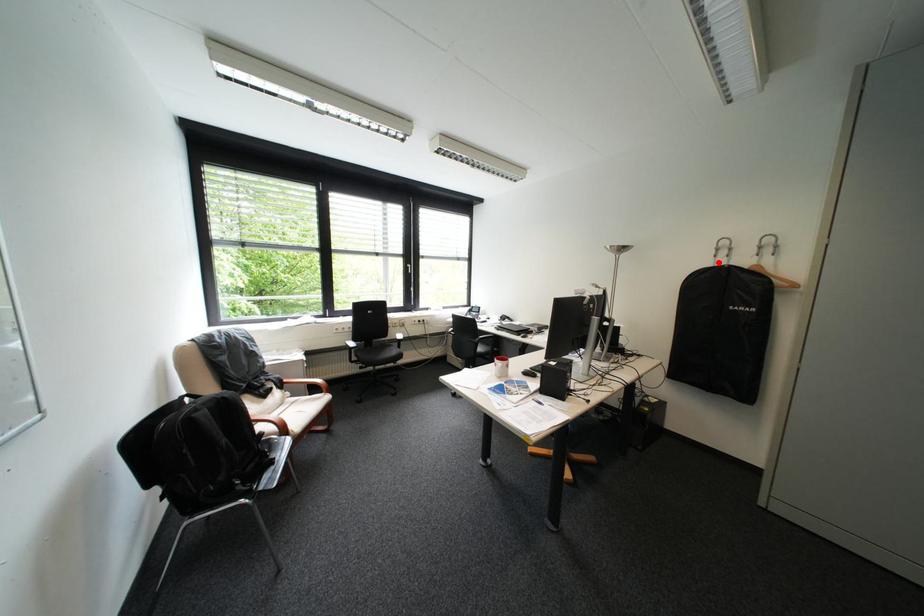
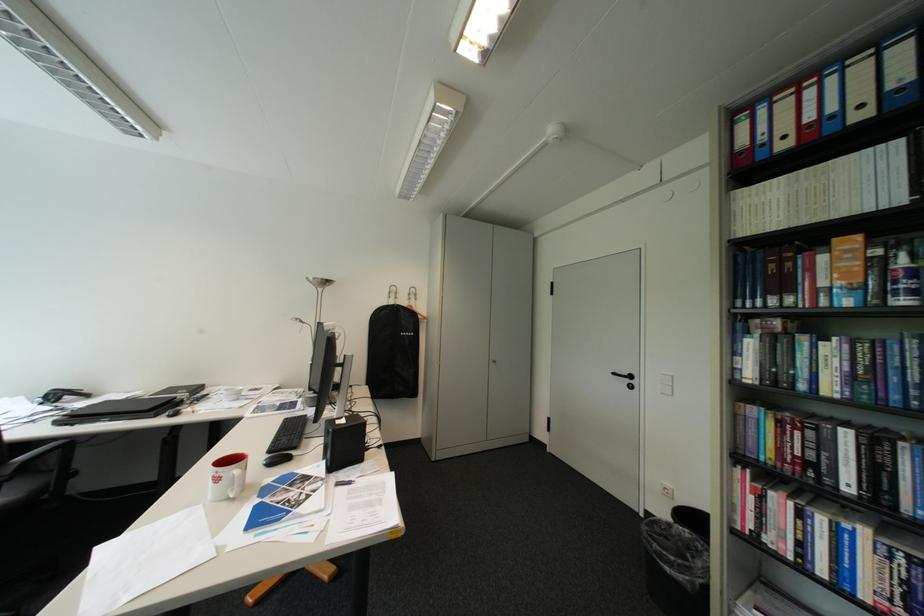
Where in the second image is the point corresponding to the highlighted location from the first image?

(395, 302)